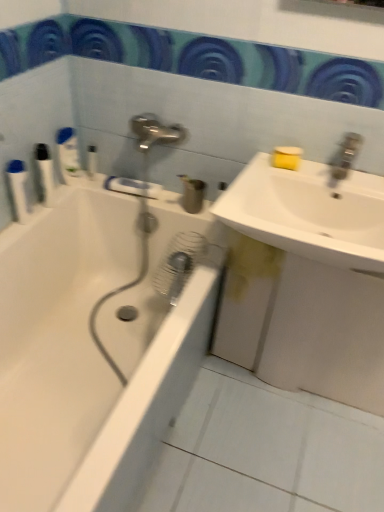
Question: Is white plastic bottle at upper left, the third toiletry when ordered from left to right, at the left side of white ceramic tile at lower center?

Choices:
 (A) no
 (B) yes

Answer: (B)

Question: From a real-world perspective, is white plastic bottle at upper left, the third toiletry when ordered from left to right, located beneath white ceramic tile at lower center?

Choices:
 (A) no
 (B) yes

Answer: (A)

Question: From a real-world perspective, is white plastic bottle at upper left, acting as the 3th toiletry starting from the right, physically above white ceramic tile at lower center?

Choices:
 (A) yes
 (B) no

Answer: (A)

Question: From the image's perspective, is white plastic bottle at upper left, acting as the 3th toiletry starting from the right, under white ceramic tile at lower center?

Choices:
 (A) yes
 (B) no

Answer: (B)

Question: Can you confirm if white plastic bottle at upper left, acting as the 3th toiletry starting from the right, is bigger than white ceramic tile at lower center?

Choices:
 (A) yes
 (B) no

Answer: (B)

Question: Is white plastic bottles at left, the first toiletry viewed from the left, bigger or smaller than white plastic bottle at upper left, the fourth toiletry positioned from the left?

Choices:
 (A) big
 (B) small

Answer: (A)

Question: Is point (6, 168) positioned closer to the camera than point (94, 167)?

Choices:
 (A) closer
 (B) farther

Answer: (A)

Question: From their relative heights in the image, would you say white plastic bottles at left, acting as the 5th toiletry starting from the right, is taller or shorter than white plastic bottle at upper left, which ranks as the second toiletry in right-to-left order?

Choices:
 (A) tall
 (B) short

Answer: (A)

Question: From the image's perspective, is white plastic bottles at left, the first toiletry viewed from the left, located above or below white plastic bottle at upper left, which ranks as the second toiletry in right-to-left order?

Choices:
 (A) above
 (B) below

Answer: (B)

Question: From the image's perspective, relative to white plastic bottles at left, acting as the fourth toiletry starting from the right, is matte plastic cup at center, placed as the first toiletry when sorted from right to left, above or below?

Choices:
 (A) above
 (B) below

Answer: (B)

Question: From their relative heights in the image, would you say matte plastic cup at center, the 5th toiletry when ordered from left to right, is taller or shorter than white plastic bottles at left, the second toiletry viewed from the left?

Choices:
 (A) short
 (B) tall

Answer: (A)

Question: Looking at their shapes, would you say matte plastic cup at center, the 5th toiletry when ordered from left to right, is wider or thinner than white plastic bottles at left, acting as the fourth toiletry starting from the right?

Choices:
 (A) wide
 (B) thin

Answer: (A)

Question: In terms of size, does matte plastic cup at center, the 5th toiletry when ordered from left to right, appear bigger or smaller than white plastic bottles at left, the second toiletry viewed from the left?

Choices:
 (A) big
 (B) small

Answer: (A)

Question: Considering the positions of white ceramic tile at lower center and white plastic bottles at left, acting as the fourth toiletry starting from the right, in the image, is white ceramic tile at lower center bigger or smaller than white plastic bottles at left, acting as the fourth toiletry starting from the right,?

Choices:
 (A) small
 (B) big

Answer: (B)

Question: Visually, is white ceramic tile at lower center positioned to the left or to the right of white plastic bottles at left, acting as the fourth toiletry starting from the right?

Choices:
 (A) left
 (B) right

Answer: (B)